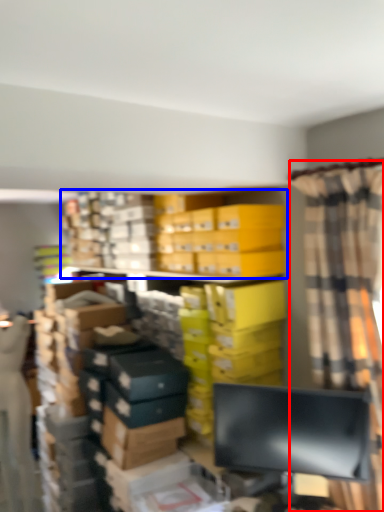
Question: Which of the following is the farthest to the observer, curtain (highlighted by a red box) or bookcase (highlighted by a blue box)?

Choices:
 (A) curtain
 (B) bookcase

Answer: (B)